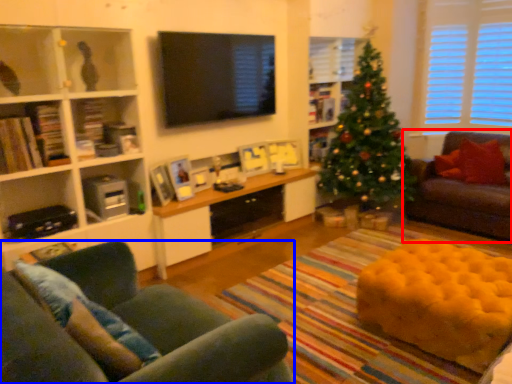
Question: Which of the following is the closest to the observer, studio couch (highlighted by a red box) or studio couch (highlighted by a blue box)?

Choices:
 (A) studio couch
 (B) studio couch

Answer: (B)